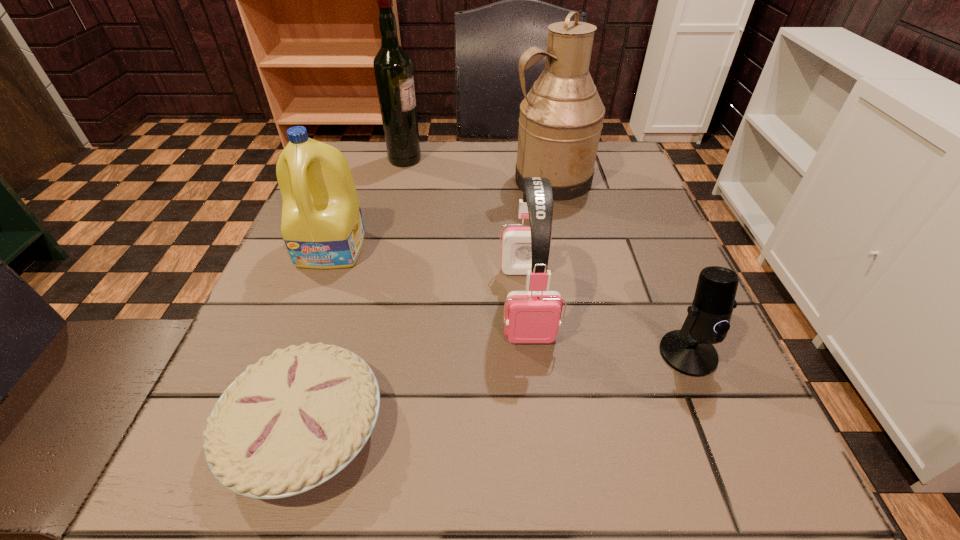
The height and width of the screenshot is (540, 960). Find the location of `vacant area that lies between the rightmost object and the earphone`. vacant area that lies between the rightmost object and the earphone is located at coordinates (608, 328).

Find the location of a particular element. vacant area between the wine bottle and the pitcher is located at coordinates (478, 170).

This screenshot has width=960, height=540. In order to click on empty space that is in between the earphone and the fifth tallest object in this screenshot , I will do `click(608, 328)`.

Image resolution: width=960 pixels, height=540 pixels. What are the coordinates of `unoccupied position between the detergent and the wine bottle` in the screenshot? It's located at (369, 204).

I want to click on free space between the detergent and the wine bottle, so click(369, 204).

I want to click on free space between the earphone and the rightmost object, so click(608, 328).

Locate an element on the screen. vacant space that is in between the pitcher and the wine bottle is located at coordinates (478, 170).

Identify the location of vacant area between the pitcher and the pie. (428, 304).

In order to click on vacant area between the wine bottle and the pitcher in this screenshot , I will do `click(478, 170)`.

Identify which object is the second closest to the pie. Please provide its 2D coordinates. Your answer should be formatted as a tuple, i.e. [(x, y)], where the tuple contains the x and y coordinates of a point satisfying the conditions above.

[(322, 226)]